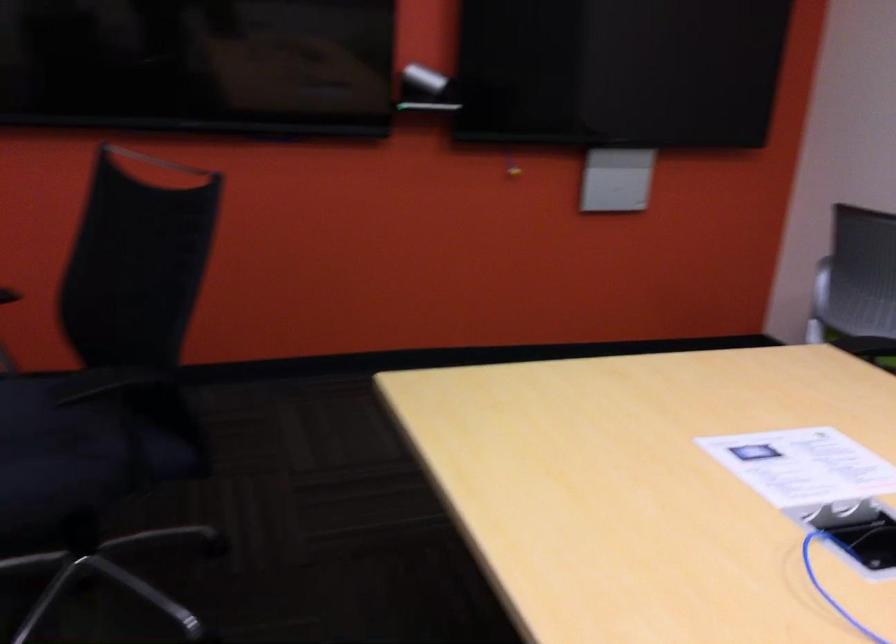
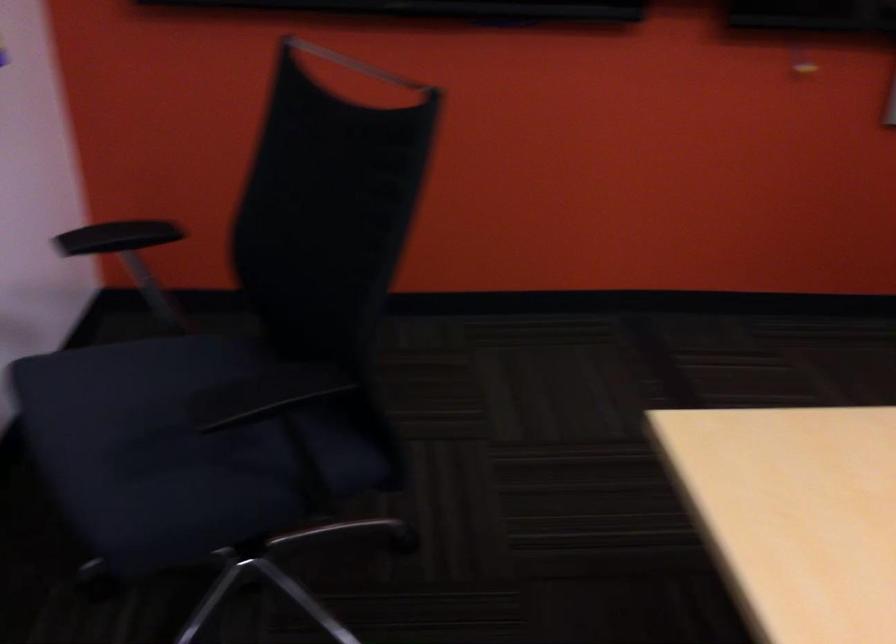
Question: How did the camera likely rotate?

Choices:
 (A) Left
 (B) Right
 (C) Up
 (D) Down

Answer: (A)